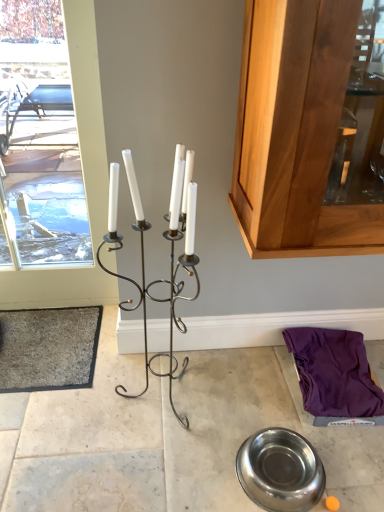
This screenshot has height=512, width=384. In order to click on free point behind polished stainless steel bowl at lower center in this screenshot , I will do `click(253, 411)`.